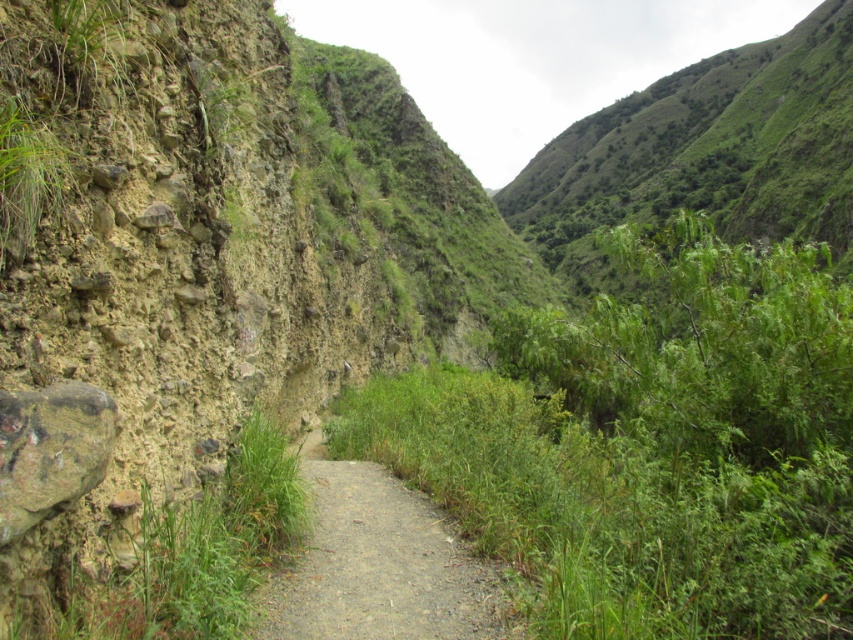
Question: Where is green leafy bush at center located in relation to gray gravel path at center in the image?

Choices:
 (A) above
 (B) below

Answer: (A)

Question: Which object appears farthest from the camera in this image?

Choices:
 (A) gray gravel path at center
 (B) green leafy bush at center

Answer: (A)

Question: Is green leafy bush at center positioned before gray gravel path at center?

Choices:
 (A) no
 (B) yes

Answer: (B)

Question: Is green leafy bush at center to the right of gray gravel path at center from the viewer's perspective?

Choices:
 (A) yes
 (B) no

Answer: (A)